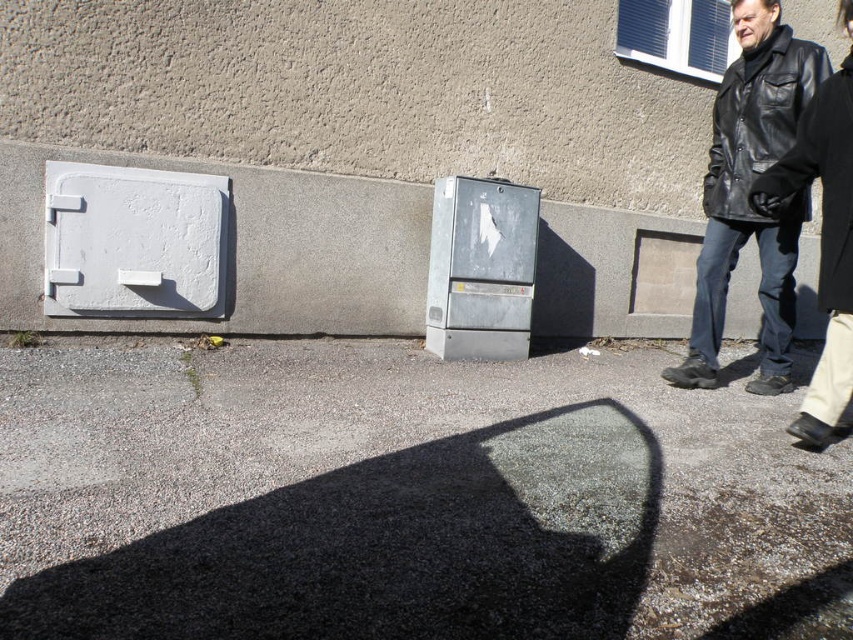
Question: Is the position of gray gravel pavement at center more distant than that of black leather jacket at upper right?

Choices:
 (A) no
 (B) yes

Answer: (A)

Question: Which point is closer to the camera taking this photo?

Choices:
 (A) (494, 394)
 (B) (775, 360)

Answer: (A)

Question: Among these points, which one is farthest from the camera?

Choices:
 (A) (320, 481)
 (B) (724, 312)
 (C) (828, 200)

Answer: (B)

Question: Does gray gravel pavement at center appear on the right side of black leather jacket at right?

Choices:
 (A) no
 (B) yes

Answer: (A)

Question: Which of the following is the farthest from the observer?

Choices:
 (A) black leather jacket at right
 (B) black leather jacket at upper right

Answer: (B)

Question: Can you confirm if black leather jacket at upper right is smaller than black leather jacket at right?

Choices:
 (A) no
 (B) yes

Answer: (A)